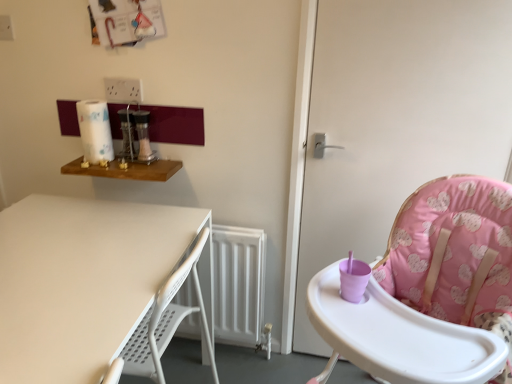
Question: Does pink fabric high chair at right lie behind white paper towel at upper left?

Choices:
 (A) no
 (B) yes

Answer: (A)

Question: Does pink fabric high chair at right have a smaller size compared to white paper towel at upper left?

Choices:
 (A) yes
 (B) no

Answer: (B)

Question: Considering the relative sizes of pink fabric high chair at right and white paper towel at upper left in the image provided, is pink fabric high chair at right wider than white paper towel at upper left?

Choices:
 (A) no
 (B) yes

Answer: (A)

Question: From the image's perspective, is pink fabric high chair at right above white paper towel at upper left?

Choices:
 (A) no
 (B) yes

Answer: (A)

Question: From a real-world perspective, is pink fabric high chair at right under white paper towel at upper left?

Choices:
 (A) yes
 (B) no

Answer: (A)

Question: From a real-world perspective, is pink fabric highchair at right above or below wooden shelf at upper left, positioned as the 2th table in bottom-to-top order?

Choices:
 (A) above
 (B) below

Answer: (B)

Question: Looking at the image, does pink fabric highchair at right seem bigger or smaller compared to wooden shelf at upper left, positioned as the 2th table in bottom-to-top order?

Choices:
 (A) small
 (B) big

Answer: (B)

Question: Is pink fabric highchair at right in front of or behind wooden shelf at upper left, positioned as the 2th table in bottom-to-top order, in the image?

Choices:
 (A) front
 (B) behind

Answer: (A)

Question: Is pink fabric highchair at right wider or thinner than wooden shelf at upper left, which ranks as the 1th table in top-to-bottom order?

Choices:
 (A) wide
 (B) thin

Answer: (A)

Question: Looking at their shapes, would you say white matte table at lower left, the 2th table from the top, is wider or thinner than wooden shelf at upper left, positioned as the 2th table in bottom-to-top order?

Choices:
 (A) wide
 (B) thin

Answer: (A)

Question: From the image's perspective, is white matte table at lower left, the 2th table from the top, located above or below wooden shelf at upper left, which ranks as the 1th table in top-to-bottom order?

Choices:
 (A) above
 (B) below

Answer: (B)

Question: From their relative heights in the image, would you say white matte table at lower left, the 2th table from the top, is taller or shorter than wooden shelf at upper left, which ranks as the 1th table in top-to-bottom order?

Choices:
 (A) short
 (B) tall

Answer: (B)

Question: In terms of size, does white matte table at lower left, the 2th table from the top, appear bigger or smaller than wooden shelf at upper left, which ranks as the 1th table in top-to-bottom order?

Choices:
 (A) big
 (B) small

Answer: (A)

Question: Considering the positions of wooden shelf at upper left, positioned as the 2th table in bottom-to-top order, and pink fabric high chair at right in the image, is wooden shelf at upper left, positioned as the 2th table in bottom-to-top order, taller or shorter than pink fabric high chair at right?

Choices:
 (A) short
 (B) tall

Answer: (A)

Question: Is wooden shelf at upper left, which ranks as the 1th table in top-to-bottom order, spatially inside pink fabric high chair at right, or outside of it?

Choices:
 (A) outside
 (B) inside

Answer: (A)